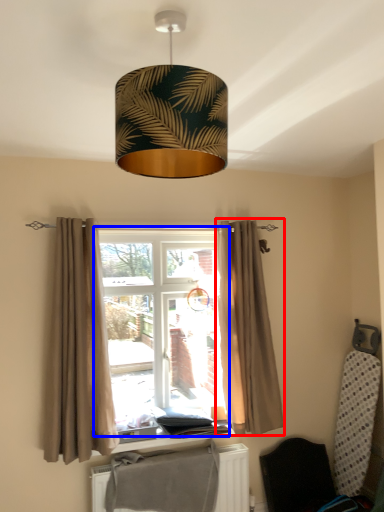
Question: Which object appears farthest to the camera in this image, curtain (highlighted by a red box) or bay window (highlighted by a blue box)?

Choices:
 (A) curtain
 (B) bay window

Answer: (A)